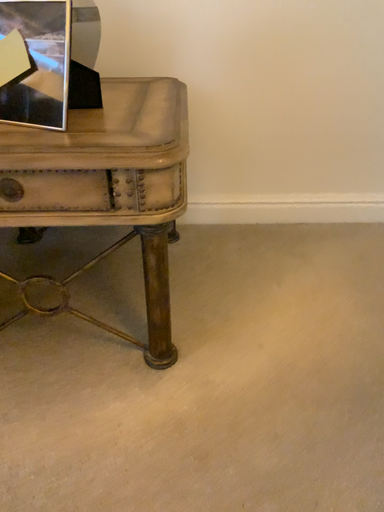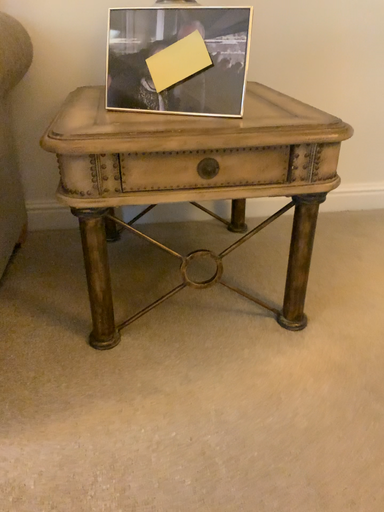
Question: How did the camera likely rotate when shooting the video?

Choices:
 (A) rotated left
 (B) rotated right

Answer: (B)